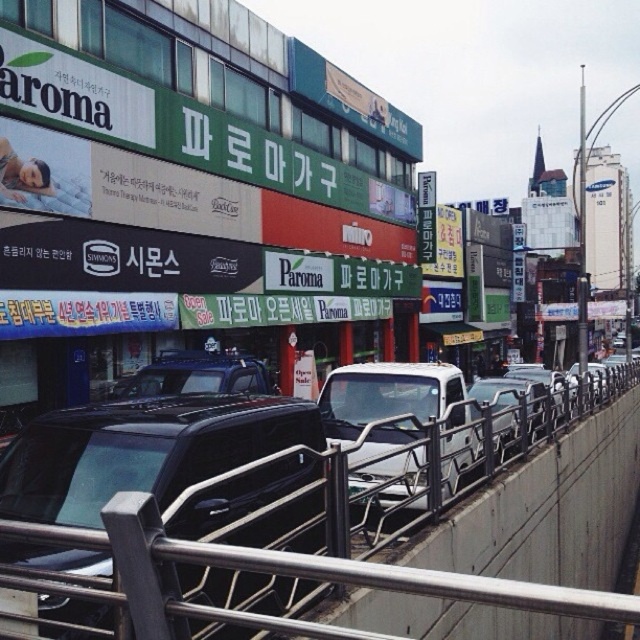
Who is lower down, metallic gray rail at center or metallic silver truck at center?

metallic gray rail at center

The image size is (640, 640). What do you see at coordinates (170, 468) in the screenshot?
I see `metallic gray rail at center` at bounding box center [170, 468].

Does point (244, 584) come farther from viewer compared to point (506, 392)?

No.

I want to click on metallic gray rail at center, so click(x=170, y=468).

Is point (90, 612) farther from camera compared to point (536, 394)?

No, (90, 612) is in front of (536, 394).

Is black matte car at center in front of metallic silver truck at center?

Yes, it is.

What do you see at coordinates (141, 451) in the screenshot? I see `black matte car at center` at bounding box center [141, 451].

Image resolution: width=640 pixels, height=640 pixels. In order to click on black matte car at center in this screenshot , I will do `click(141, 451)`.

Is black matte car at center to the right of white matte truck at center from the viewer's perspective?

Incorrect, black matte car at center is not on the right side of white matte truck at center.

Is black matte car at center in front of white matte truck at center?

That is True.

Who is more forward, (148, 488) or (394, 378)?

Positioned in front is point (148, 488).

This screenshot has height=640, width=640. Find the location of `black matte car at center`. black matte car at center is located at coordinates (141, 451).